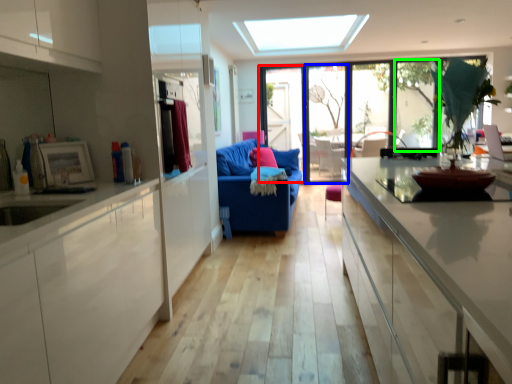
Question: Which object is positioned farthest from screen door (highlighted by a red box)? Select from glass door (highlighted by a blue box) and window (highlighted by a green box).

Choices:
 (A) glass door
 (B) window

Answer: (B)